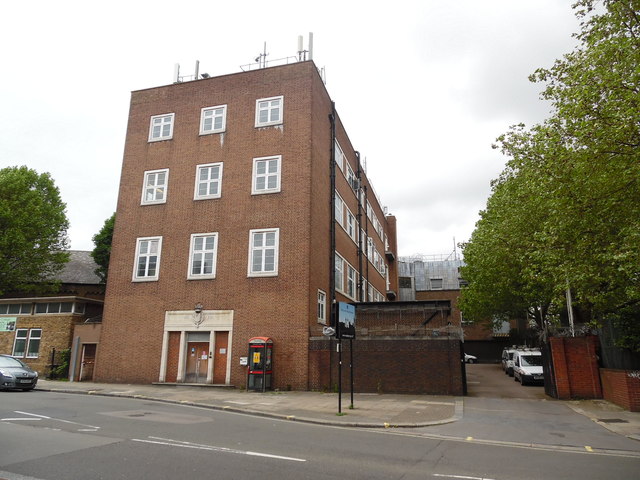
This screenshot has width=640, height=480. What are the coordinates of `door` in the screenshot? It's located at (196, 366), (86, 362).